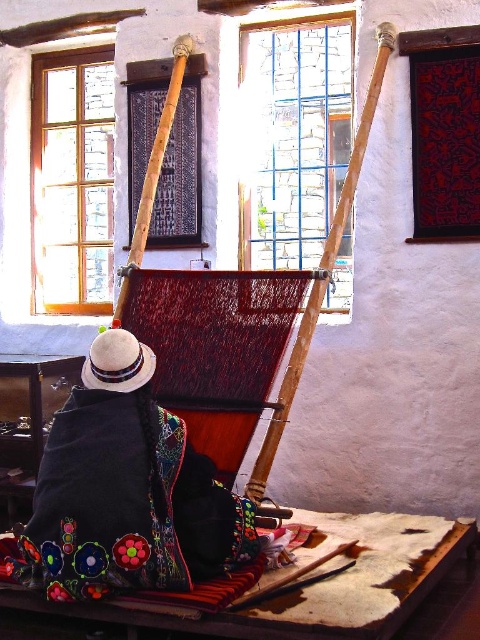
You are an artisan who needs to place a new spool of thread on the table near the embroidered fabric at lower left. The table is located at coordinates point (108, 483). Can you confirm the location of the embroidered fabric at lower left relative to the table?

The point (108, 483) indicates the embroidered fabric at lower left is located at that coordinate, so the table is at the same location as the embroidered fabric at lower left.

What is the exact location of the embroidered fabric at lower left in the image?

The embroidered fabric at lower left is located at point (108,483).

You are an artisan working at the loom and need to retrieve both the embroidered fabric at lower left and the white felt hat at lower left. Which object should you reach for first if you want to grab the one that is closer to the center of the loom?

The embroidered fabric at lower left is to the right of the white felt hat at lower left, so it is closer to the center of the loom. You should reach for the embroidered fabric at lower left first.